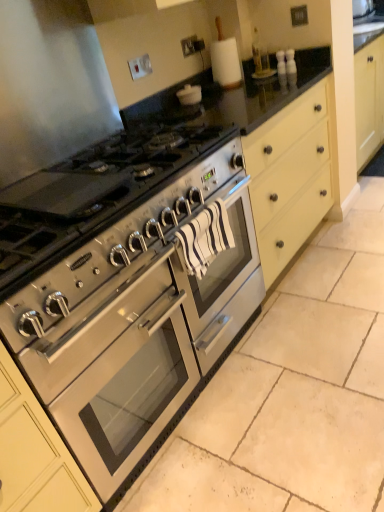
Question: Considering the positions of stainless steel oven at center and satin silver gas stove at center in the image, is stainless steel oven at center wider or thinner than satin silver gas stove at center?

Choices:
 (A) thin
 (B) wide

Answer: (B)

Question: Visually, is stainless steel oven at center positioned to the left or to the right of satin silver gas stove at center?

Choices:
 (A) left
 (B) right

Answer: (B)

Question: From their relative heights in the image, would you say stainless steel oven at center is taller or shorter than satin silver gas stove at center?

Choices:
 (A) tall
 (B) short

Answer: (A)

Question: From their relative heights in the image, would you say satin silver gas stove at center is taller or shorter than stainless steel oven at center?

Choices:
 (A) tall
 (B) short

Answer: (B)

Question: Considering the positions of point (104, 185) and point (125, 411), is point (104, 185) closer or farther from the camera than point (125, 411)?

Choices:
 (A) closer
 (B) farther

Answer: (A)

Question: Is satin silver gas stove at center wider or thinner than stainless steel oven at center?

Choices:
 (A) wide
 (B) thin

Answer: (B)

Question: Looking at the image, does satin silver gas stove at center seem bigger or smaller compared to stainless steel oven at center?

Choices:
 (A) small
 (B) big

Answer: (A)